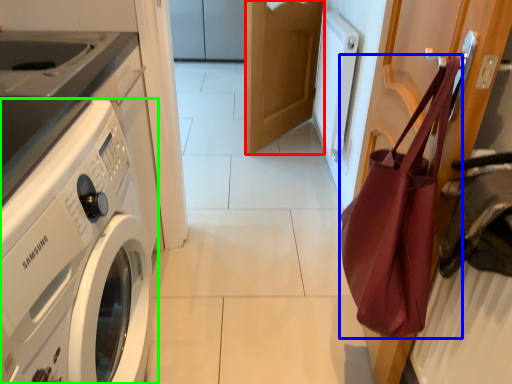
Question: Which object is the closest to the door (highlighted by a red box)? Choose among these: tote bag (highlighted by a blue box) or washing machine (highlighted by a green box).

Choices:
 (A) tote bag
 (B) washing machine

Answer: (A)